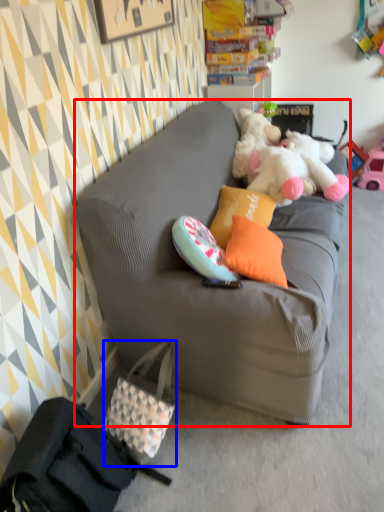
Question: Which of the following is the closest to the observer, studio couch (highlighted by a red box) or handbag (highlighted by a blue box)?

Choices:
 (A) studio couch
 (B) handbag

Answer: (A)